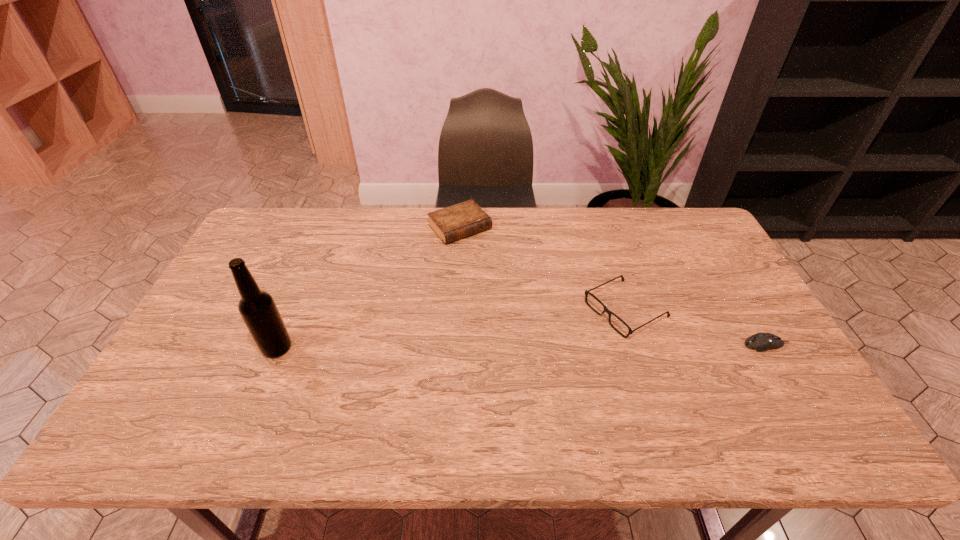
Find the location of `vacant region at the far right corner of the desktop`. vacant region at the far right corner of the desktop is located at coordinates (659, 207).

This screenshot has width=960, height=540. What are the coordinates of `free space between the third object from left to right and the shortest object` in the screenshot? It's located at (696, 327).

Locate an element on the screen. vacant space that is in between the computer mouse and the diary is located at coordinates (613, 286).

Where is `empty space that is in between the computer mouse and the leftmost object`? The width and height of the screenshot is (960, 540). empty space that is in between the computer mouse and the leftmost object is located at coordinates (521, 346).

I want to click on free space that is in between the computer mouse and the beer bottle, so click(x=521, y=346).

Locate an element on the screen. The width and height of the screenshot is (960, 540). free space between the farthest object and the third object from left to right is located at coordinates tap(542, 268).

Where is `free spot between the spectacles and the computer mouse`? This screenshot has height=540, width=960. free spot between the spectacles and the computer mouse is located at coordinates (696, 327).

Locate an element on the screen. Image resolution: width=960 pixels, height=540 pixels. vacant point located between the spectacles and the tallest object is located at coordinates (451, 328).

Identify the location of empty location between the tallest object and the third object from right to left. (369, 288).

At what (x,y) coordinates should I click in order to perform the action: click on empty space that is in between the spectacles and the beer bottle. Please return your answer as a coordinate pair (x, y). Looking at the image, I should click on (451, 328).